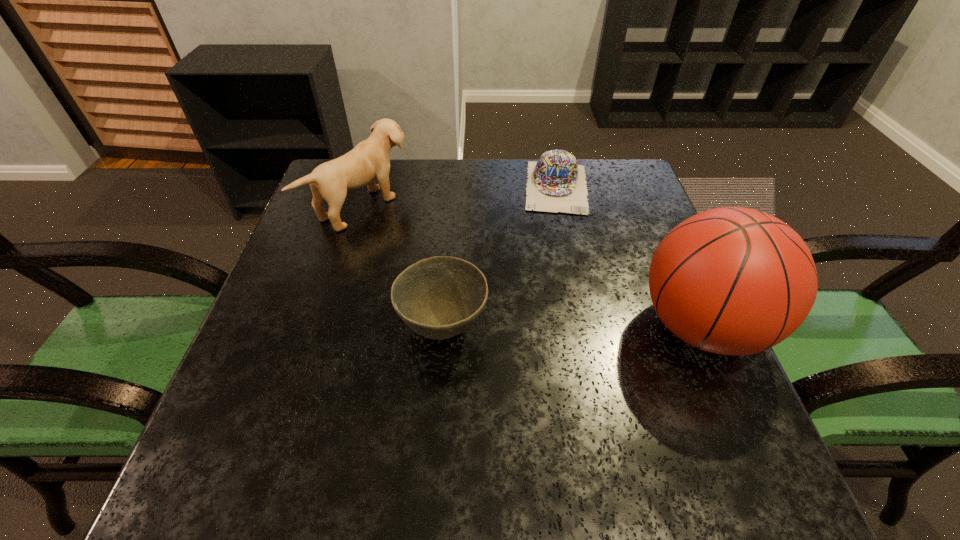
This screenshot has height=540, width=960. I want to click on blank space located on the left side of the puppy, so click(478, 276).

Locate an element on the screen. vacant space located 0.120m on the left side of the puppy is located at coordinates pyautogui.click(x=433, y=249).

Image resolution: width=960 pixels, height=540 pixels. What are the coordinates of `vacant space located 0.130m on the left side of the puppy` in the screenshot? It's located at (436, 251).

This screenshot has width=960, height=540. I want to click on free location located 0.200m on the front, side, and top of the cap, so click(x=560, y=271).

Where is `free point located 0.290m on the front, side, and top of the cap`? The height and width of the screenshot is (540, 960). free point located 0.290m on the front, side, and top of the cap is located at coordinates (561, 300).

Where is `free location located 0.150m on the front, side, and top of the cap`? The image size is (960, 540). free location located 0.150m on the front, side, and top of the cap is located at coordinates (560, 255).

Locate an element on the screen. The height and width of the screenshot is (540, 960). puppy situated at the far edge is located at coordinates (369, 159).

This screenshot has width=960, height=540. Find the location of `cap that is at the far edge`. cap that is at the far edge is located at coordinates (556, 183).

I want to click on object present at the left edge, so click(x=369, y=159).

The height and width of the screenshot is (540, 960). In order to click on basketball at the right edge in this screenshot , I will do `click(733, 281)`.